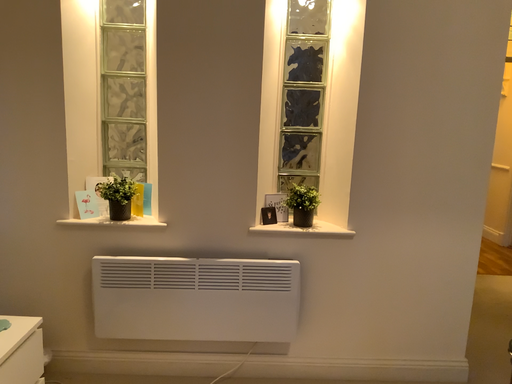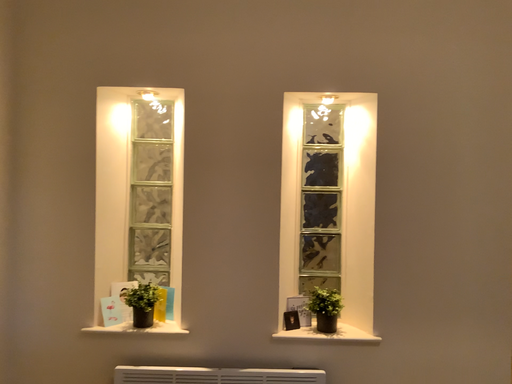
Question: How did the camera likely rotate when shooting the video?

Choices:
 (A) rotated upward
 (B) rotated downward

Answer: (A)